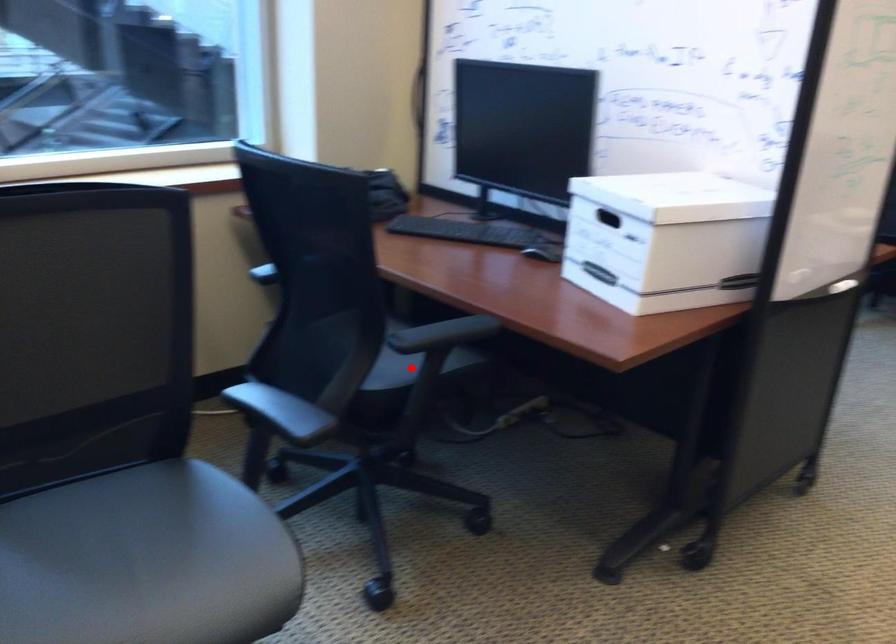
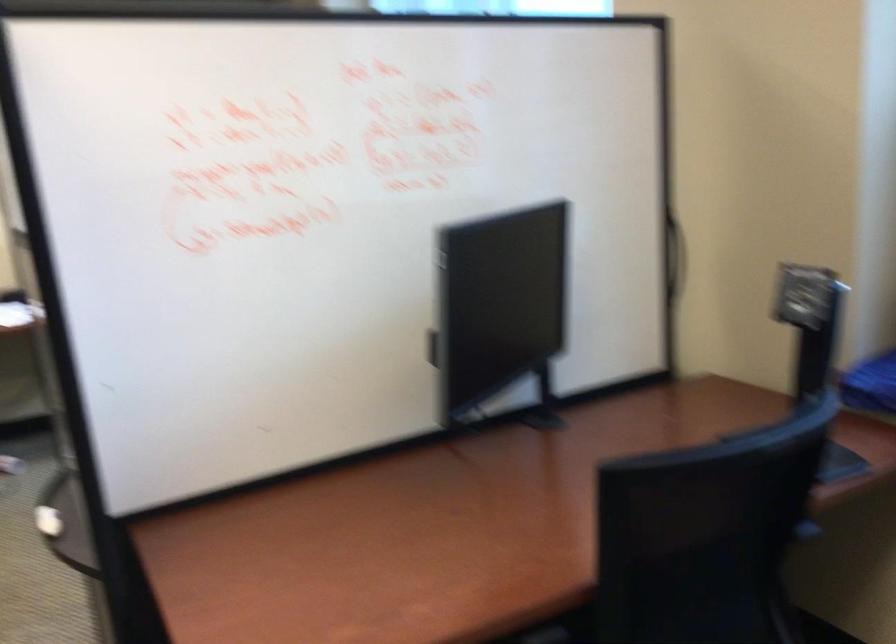
Question: I am providing you with two images of the same scene from different viewpoints. A red point is marked on the first image. Is the red point's position out of view in image 2?

Choices:
 (A) Yes
 (B) No

Answer: (A)